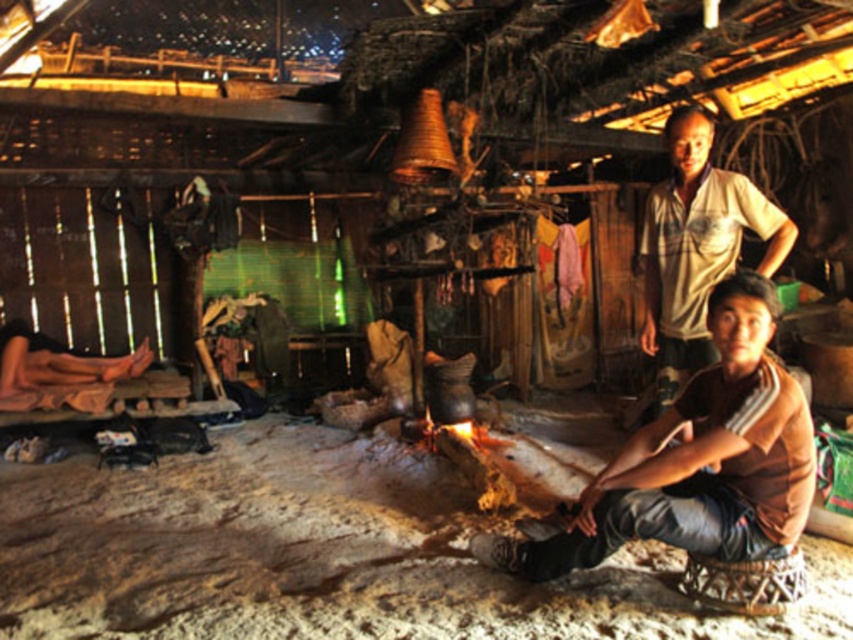
Question: Can you confirm if brown cotton shirt at lower right is positioned above brown leather sandals at lower left?

Choices:
 (A) yes
 (B) no

Answer: (B)

Question: Which point is closer to the camera taking this photo?

Choices:
 (A) (38, 355)
 (B) (698, 502)

Answer: (B)

Question: Can you confirm if white cotton shirt at upper right is bigger than brown leather sandals at lower left?

Choices:
 (A) no
 (B) yes

Answer: (B)

Question: Does brown cotton shirt at lower right have a larger size compared to white cotton shirt at upper right?

Choices:
 (A) no
 (B) yes

Answer: (B)

Question: Which object is farther from the camera taking this photo?

Choices:
 (A) brown leather sandals at lower left
 (B) brown cotton shirt at lower right

Answer: (A)

Question: Considering the real-world distances, which object is farthest from the brown cotton shirt at lower right?

Choices:
 (A) white cotton shirt at upper right
 (B) brown leather sandals at lower left

Answer: (B)